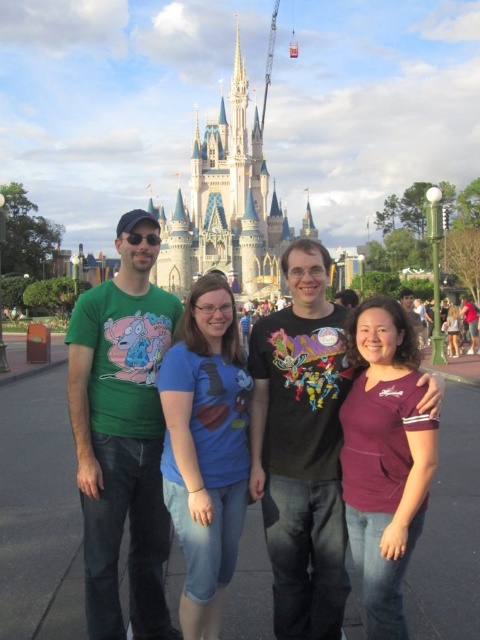
Question: Which of the following is the farthest from the observer?

Choices:
 (A) white stone castle at center
 (B) green cotton t-shirt at center

Answer: (A)

Question: Can you confirm if green cotton t-shirt at center is wider than white stone castle at center?

Choices:
 (A) yes
 (B) no

Answer: (A)

Question: Which point is farther to the camera?

Choices:
 (A) green cotton t-shirt at center
 (B) white stone castle at center

Answer: (B)

Question: Which point is closer to the camera?

Choices:
 (A) green cotton t-shirt at center
 (B) white stone castle at center

Answer: (A)

Question: Does green cotton t-shirt at center have a lesser width compared to white stone castle at center?

Choices:
 (A) no
 (B) yes

Answer: (A)

Question: Is green cotton t-shirt at center smaller than white stone castle at center?

Choices:
 (A) no
 (B) yes

Answer: (A)